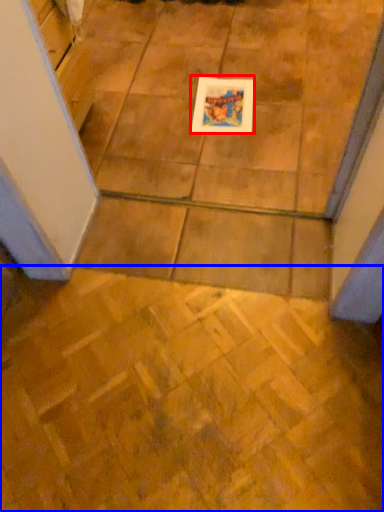
Question: Which point is closer to the camera, picture frame (highlighted by a red box) or ceramic tile (highlighted by a blue box)?

Choices:
 (A) picture frame
 (B) ceramic tile

Answer: (B)